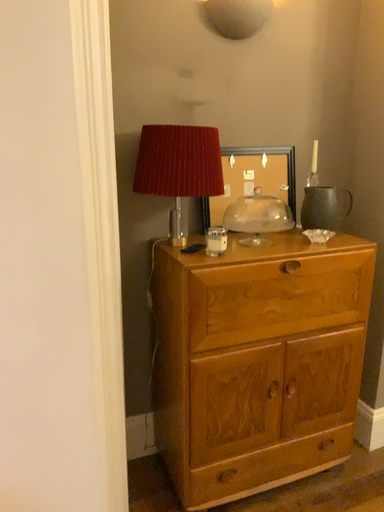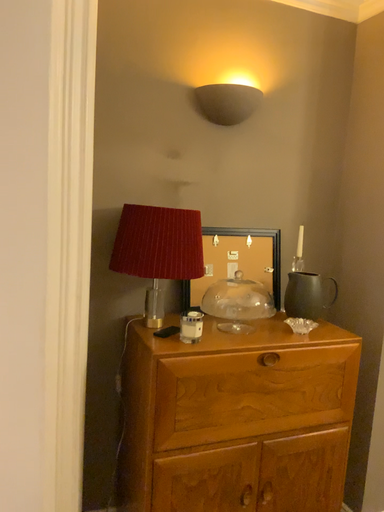
Question: How did the camera likely rotate when shooting the video?

Choices:
 (A) rotated upward
 (B) rotated downward

Answer: (A)